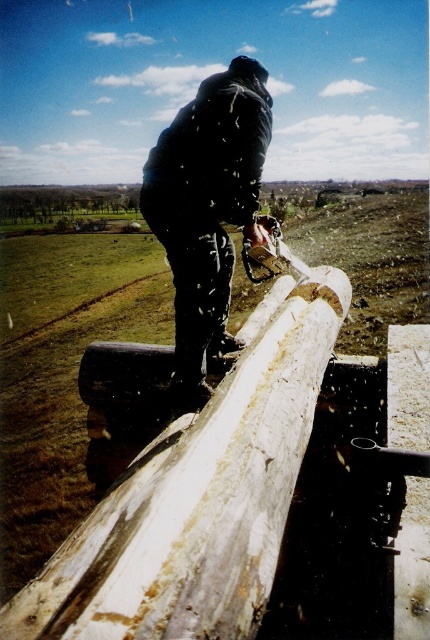
Question: Which point is farther to the camera?

Choices:
 (A) (168, 131)
 (B) (236, 518)

Answer: (A)

Question: Which object appears closest to the camera in this image?

Choices:
 (A) dark blue jacket at upper center
 (B) white wood beam at center

Answer: (B)

Question: Which object is closer to the camera taking this photo?

Choices:
 (A) dark blue jacket at upper center
 (B) white wood beam at center

Answer: (B)

Question: Where is white wood beam at center located in relation to dark blue jacket at upper center in the image?

Choices:
 (A) right
 (B) left

Answer: (A)

Question: Can you confirm if white wood beam at center is bigger than dark blue jacket at upper center?

Choices:
 (A) no
 (B) yes

Answer: (A)

Question: Is white wood beam at center to the left of dark blue jacket at upper center from the viewer's perspective?

Choices:
 (A) yes
 (B) no

Answer: (B)